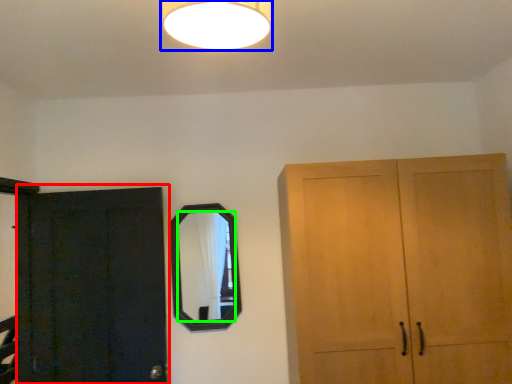
Question: Which object is the closest to the door (highlighted by a red box)? Choose among these: lamp (highlighted by a blue box) or mirror (highlighted by a green box).

Choices:
 (A) lamp
 (B) mirror

Answer: (B)